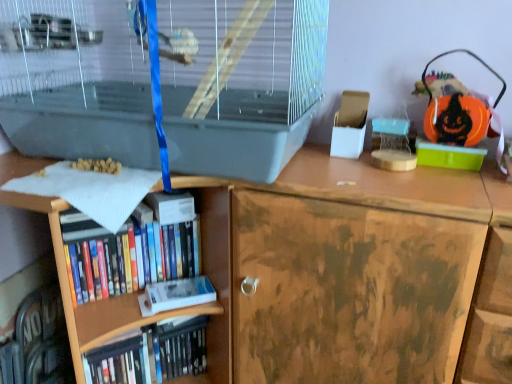
This screenshot has height=384, width=512. Describe the element at coordinates (176, 295) in the screenshot. I see `white matte paperback book at lower left, marked as the 1th paperback book in a bottom-to-top arrangement` at that location.

Find the location of a particular element. white matte paperback book at lower left, marked as the 1th paperback book in a bottom-to-top arrangement is located at coordinates (176, 295).

Locate an element on the screen. clear plastic birdcage at upper left is located at coordinates (85, 123).

What is the approximate width of hardcover book at center, the first paperback book positioned from the top?

hardcover book at center, the first paperback book positioned from the top, is 6.12 inches wide.

What are the coordinates of `white matte paperback book at lower left, acting as the 2th paperback book starting from the top` in the screenshot? It's located at (176, 295).

Does white matte paperback book at lower left, acting as the 2th paperback book starting from the top, turn towards clear plastic birdcage at upper left?

No, white matte paperback book at lower left, acting as the 2th paperback book starting from the top, is not turned towards clear plastic birdcage at upper left.

Between white matte paperback book at lower left, marked as the 1th paperback book in a bottom-to-top arrangement, and clear plastic birdcage at upper left, which one has larger size?

With larger size is clear plastic birdcage at upper left.

Where is `paperback book on the right of clear plastic birdcage at upper left`? The height and width of the screenshot is (384, 512). paperback book on the right of clear plastic birdcage at upper left is located at coordinates (176, 295).

Can you tell me how much white matte paperback book at lower left, marked as the 1th paperback book in a bottom-to-top arrangement, and clear plastic birdcage at upper left differ in facing direction?

38 degrees separate the facing orientations of white matte paperback book at lower left, marked as the 1th paperback book in a bottom-to-top arrangement, and clear plastic birdcage at upper left.

Which of these two, hardcover books at lower left, which ranks as the 1th book in top-to-bottom order, or hardcover book at lower left, the first book ordered from the bottom, is wider?

hardcover book at lower left, the first book ordered from the bottom.

Between hardcover books at lower left, which ranks as the 1th book in top-to-bottom order, and hardcover book at lower left, the second book in the top-to-bottom sequence, which one has less height?

With less height is hardcover books at lower left, which ranks as the 1th book in top-to-bottom order.

From the image's perspective, which is below, hardcover books at lower left, the 2th book in the bottom-to-top sequence, or hardcover book at lower left, the first book ordered from the bottom?

hardcover book at lower left, the first book ordered from the bottom, appears lower in the image.

Is hardcover books at lower left, which ranks as the 1th book in top-to-bottom order, far away from hardcover book at lower left, the first book ordered from the bottom?

hardcover books at lower left, which ranks as the 1th book in top-to-bottom order, is near hardcover book at lower left, the first book ordered from the bottom, not far away.

Between point (174, 322) and point (163, 193), which one is positioned in front?

The point (163, 193) is more forward.

Considering the relative sizes of hardcover book at lower left, the first book ordered from the bottom, and hardcover book at center, positioned as the second paperback book in bottom-to-top order, in the image provided, is hardcover book at lower left, the first book ordered from the bottom, taller than hardcover book at center, positioned as the second paperback book in bottom-to-top order,?

Indeed, hardcover book at lower left, the first book ordered from the bottom, has a greater height compared to hardcover book at center, positioned as the second paperback book in bottom-to-top order.

Is hardcover book at lower left, the first book ordered from the bottom, positioned far away from hardcover book at center, positioned as the second paperback book in bottom-to-top order?

No, hardcover book at lower left, the first book ordered from the bottom, is in close proximity to hardcover book at center, positioned as the second paperback book in bottom-to-top order.

Looking at this image, between hardcover book at lower left, the first book ordered from the bottom, and hardcover book at center, positioned as the second paperback book in bottom-to-top order, which one has smaller size?

hardcover book at center, positioned as the second paperback book in bottom-to-top order, is smaller.

Is white matte paperback book at lower left, acting as the 2th paperback book starting from the top, far from hardcover books at lower left, which ranks as the 1th book in top-to-bottom order?

Actually, white matte paperback book at lower left, acting as the 2th paperback book starting from the top, and hardcover books at lower left, which ranks as the 1th book in top-to-bottom order, are a little close together.

Is white matte paperback book at lower left, acting as the 2th paperback book starting from the top, looking in the opposite direction of hardcover books at lower left, the 2th book in the bottom-to-top sequence?

No, white matte paperback book at lower left, acting as the 2th paperback book starting from the top, is not facing away from hardcover books at lower left, the 2th book in the bottom-to-top sequence.

Which of these two, white matte paperback book at lower left, marked as the 1th paperback book in a bottom-to-top arrangement, or hardcover books at lower left, which ranks as the 1th book in top-to-bottom order, is thinner?

white matte paperback book at lower left, marked as the 1th paperback book in a bottom-to-top arrangement, is thinner.

From the image's perspective, which one is positioned higher, hardcover book at center, the first paperback book positioned from the top, or clear plastic birdcage at upper left?

clear plastic birdcage at upper left is shown above in the image.

Is hardcover book at center, the first paperback book positioned from the top, outside of clear plastic birdcage at upper left?

hardcover book at center, the first paperback book positioned from the top, is positioned outside clear plastic birdcage at upper left.

Is hardcover book at center, positioned as the second paperback book in bottom-to-top order, next to clear plastic birdcage at upper left?

There is a gap between hardcover book at center, positioned as the second paperback book in bottom-to-top order, and clear plastic birdcage at upper left.

From a real-world perspective, is hardcover book at lower left, the second book in the top-to-bottom sequence, positioned above or below white matte paperback book at lower left, acting as the 2th paperback book starting from the top?

From a real-world perspective, hardcover book at lower left, the second book in the top-to-bottom sequence, is physically below white matte paperback book at lower left, acting as the 2th paperback book starting from the top.

From the image's perspective, which paperback book is the 1st one above the hardcover book at lower left, the second book in the top-to-bottom sequence? Please provide its 2D coordinates.

[(176, 295)]

Is hardcover book at lower left, the second book in the top-to-bottom sequence, inside the boundaries of white matte paperback book at lower left, marked as the 1th paperback book in a bottom-to-top arrangement, or outside?

hardcover book at lower left, the second book in the top-to-bottom sequence, is not inside white matte paperback book at lower left, marked as the 1th paperback book in a bottom-to-top arrangement, it's outside.

Is point (174, 286) closer or farther from the camera than point (199, 359)?

Point (174, 286) appears to be closer to the viewer than point (199, 359).

Is hardcover book at lower left, the first book ordered from the bottom, at the back of white matte paperback book at lower left, acting as the 2th paperback book starting from the top?

No, white matte paperback book at lower left, acting as the 2th paperback book starting from the top,'s orientation is not away from hardcover book at lower left, the first book ordered from the bottom.

From the image's perspective, which paperback book is the 1st one above the hardcover book at lower left, the second book in the top-to-bottom sequence? Please provide its 2D coordinates.

[(176, 295)]

Find the location of a particular element. wide above the white matte paperback book at lower left, marked as the 1th paperback book in a bottom-to-top arrangement (from the image's perspective) is located at coordinates (85, 123).

Locate an element on the screen. Image resolution: width=512 pixels, height=384 pixels. book located behind the hardcover books at lower left, the 2th book in the bottom-to-top sequence is located at coordinates (150, 353).

From the image, which object appears to be farther from hardcover book at center, positioned as the second paperback book in bottom-to-top order, hardcover book at lower left, the first book ordered from the bottom, or hardcover books at lower left, the 2th book in the bottom-to-top sequence?

Based on the image, hardcover book at lower left, the first book ordered from the bottom, appears to be further to hardcover book at center, positioned as the second paperback book in bottom-to-top order.

Looking at the image, which one is located closer to hardcover book at center, the first paperback book positioned from the top, hardcover book at lower left, the first book ordered from the bottom, or white matte paperback book at lower left, acting as the 2th paperback book starting from the top?

white matte paperback book at lower left, acting as the 2th paperback book starting from the top, lies closer to hardcover book at center, the first paperback book positioned from the top, than the other object.

From the image, which object appears to be farther from white matte paperback book at lower left, marked as the 1th paperback book in a bottom-to-top arrangement, hardcover book at center, positioned as the second paperback book in bottom-to-top order, or clear plastic birdcage at upper left?

The object further to white matte paperback book at lower left, marked as the 1th paperback book in a bottom-to-top arrangement, is clear plastic birdcage at upper left.

When comparing their distances from clear plastic birdcage at upper left, does hardcover books at lower left, which ranks as the 1th book in top-to-bottom order, or white matte paperback book at lower left, marked as the 1th paperback book in a bottom-to-top arrangement, seem closer?

Based on the image, hardcover books at lower left, which ranks as the 1th book in top-to-bottom order, appears to be nearer to clear plastic birdcage at upper left.

Based on their spatial positions, is hardcover book at center, the first paperback book positioned from the top, or clear plastic birdcage at upper left further from hardcover books at lower left, which ranks as the 1th book in top-to-bottom order?

Among the two, clear plastic birdcage at upper left is located further to hardcover books at lower left, which ranks as the 1th book in top-to-bottom order.

Based on their spatial positions, is hardcover book at lower left, the first book ordered from the bottom, or white matte paperback book at lower left, marked as the 1th paperback book in a bottom-to-top arrangement, further from hardcover books at lower left, the 2th book in the bottom-to-top sequence?

The object further to hardcover books at lower left, the 2th book in the bottom-to-top sequence, is hardcover book at lower left, the first book ordered from the bottom.

Estimate the real-world distances between objects in this image. Which object is further from white matte paperback book at lower left, marked as the 1th paperback book in a bottom-to-top arrangement, hardcover books at lower left, the 2th book in the bottom-to-top sequence, or hardcover book at center, positioned as the second paperback book in bottom-to-top order?

hardcover book at center, positioned as the second paperback book in bottom-to-top order, is further to white matte paperback book at lower left, marked as the 1th paperback book in a bottom-to-top arrangement.

In the scene shown: From the image, which object appears to be farther from white matte paperback book at lower left, acting as the 2th paperback book starting from the top, hardcover book at lower left, the second book in the top-to-bottom sequence, or hardcover book at center, the first paperback book positioned from the top?

Among the two, hardcover book at center, the first paperback book positioned from the top, is located further to white matte paperback book at lower left, acting as the 2th paperback book starting from the top.

In order to click on book between clear plastic birdcage at upper left and hardcover book at lower left, the first book ordered from the bottom, vertically in this screenshot , I will do `click(127, 255)`.

This screenshot has width=512, height=384. Find the location of `paperback book between hardcover book at center, the first paperback book positioned from the top, and hardcover book at lower left, the first book ordered from the bottom, in the up-down direction`. paperback book between hardcover book at center, the first paperback book positioned from the top, and hardcover book at lower left, the first book ordered from the bottom, in the up-down direction is located at coordinates (176, 295).

Where is `paperback book that lies between clear plastic birdcage at upper left and white matte paperback book at lower left, marked as the 1th paperback book in a bottom-to-top arrangement, from top to bottom`? The width and height of the screenshot is (512, 384). paperback book that lies between clear plastic birdcage at upper left and white matte paperback book at lower left, marked as the 1th paperback book in a bottom-to-top arrangement, from top to bottom is located at coordinates (170, 206).

I want to click on book between hardcover book at center, positioned as the second paperback book in bottom-to-top order, and white matte paperback book at lower left, acting as the 2th paperback book starting from the top, in the up-down direction, so pos(127,255).